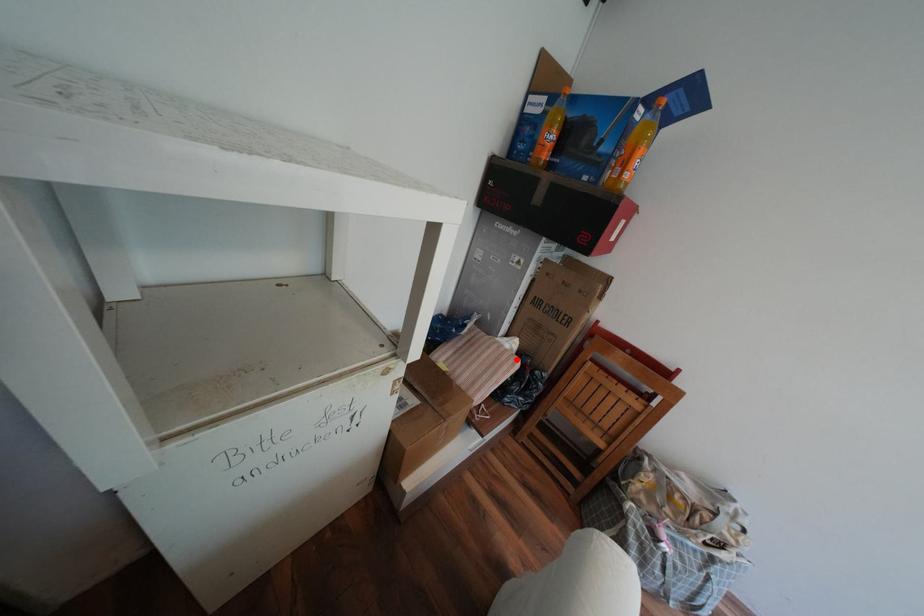
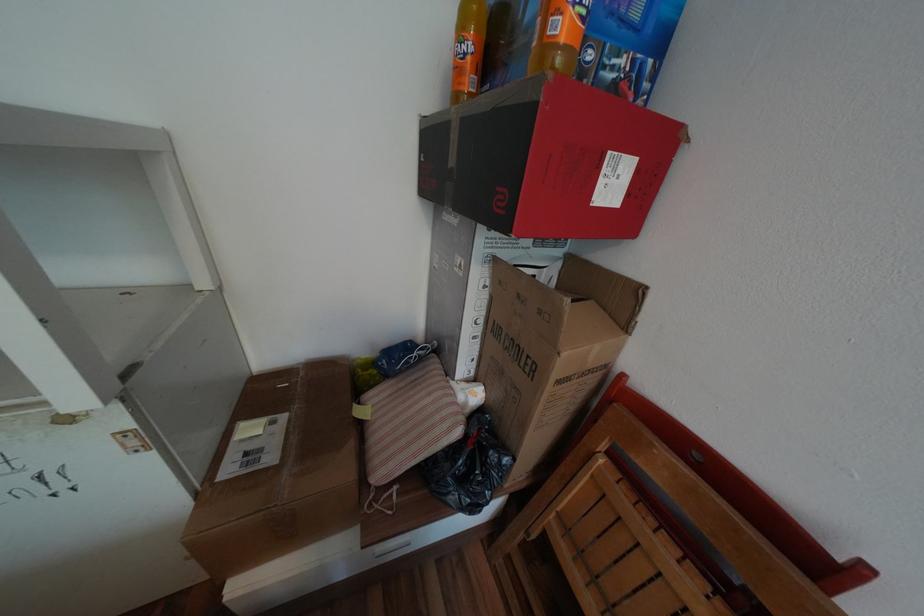
Where in the second image is the point corresponding to the highlighted location from the first image?

(453, 419)